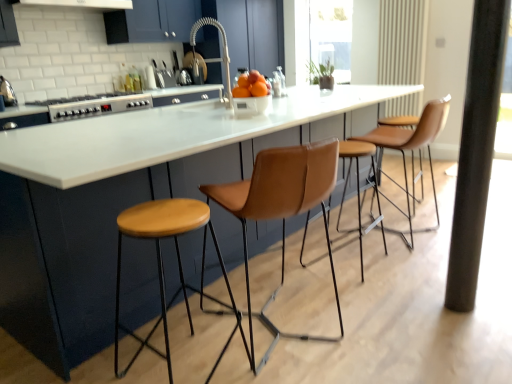
Identify the location of empty space that is in between leather-like brown stool at right, which is counted as the 1th chair, starting from the right, and black matte pillar at right. This screenshot has height=384, width=512. (410, 259).